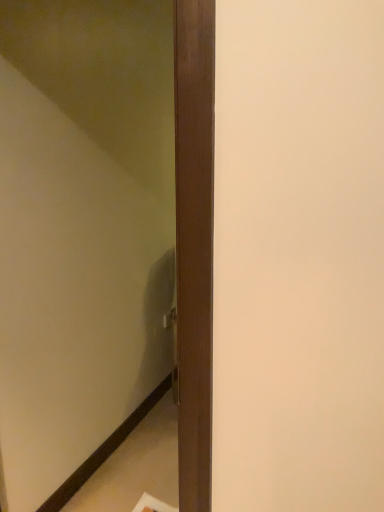
The width and height of the screenshot is (384, 512). What do you see at coordinates (81, 228) in the screenshot? I see `wooden frame at upper left` at bounding box center [81, 228].

Locate an element on the screen. This screenshot has height=512, width=384. wooden frame at upper left is located at coordinates (81, 228).

I want to click on wooden frame at upper left, so click(81, 228).